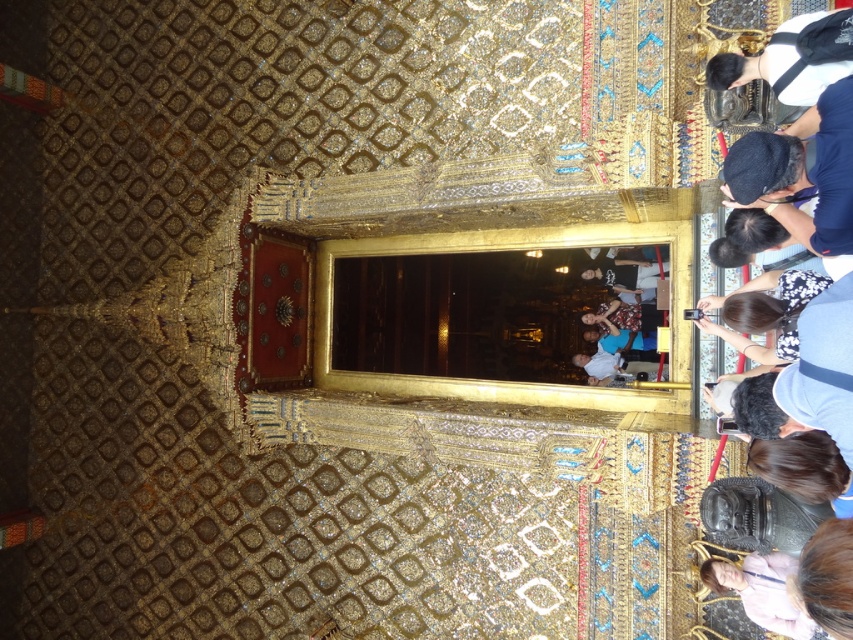
Consider the image. Can you confirm if black fabric cap at upper right is wider than pink fabric at lower right?

Indeed, black fabric cap at upper right has a greater width compared to pink fabric at lower right.

Who is higher up, black fabric cap at upper right or pink fabric at lower right?

Positioned higher is black fabric cap at upper right.

This screenshot has width=853, height=640. Find the location of `black fabric cap at upper right`. black fabric cap at upper right is located at coordinates (801, 173).